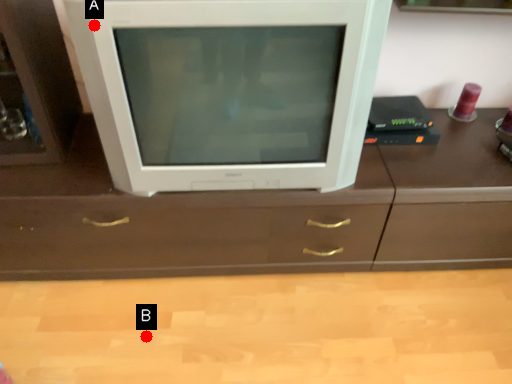
Question: Two points are circled on the image, labeled by A and B beside each circle. Which point is farther from the camera taking this photo?

Choices:
 (A) A is further
 (B) B is further

Answer: (B)